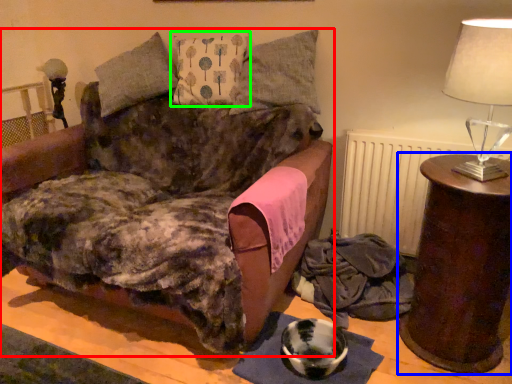
Question: Which object is positioned closest to furniture (highlighted by a red box)? Select from table (highlighted by a blue box) and pillow (highlighted by a green box).

Choices:
 (A) table
 (B) pillow

Answer: (B)